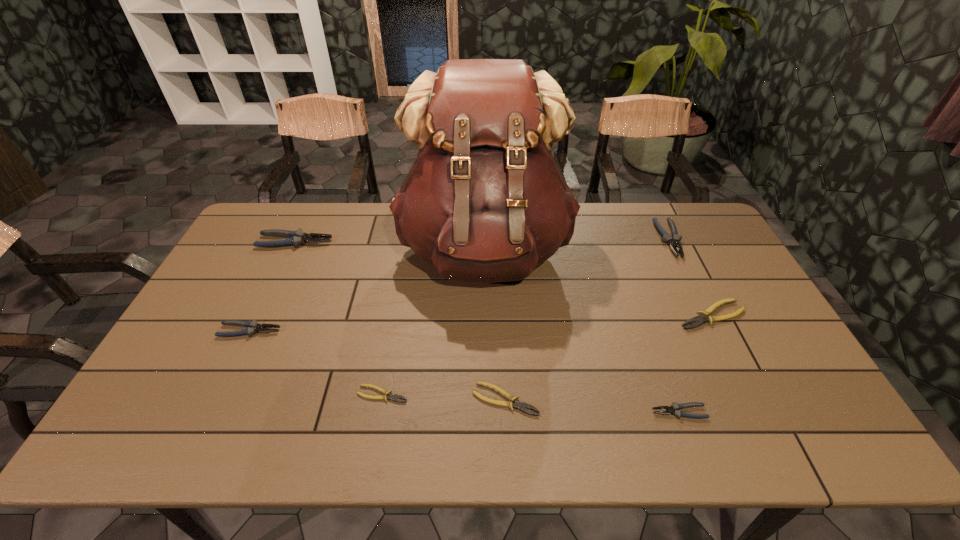
Identify which pliers is the fifth closest to the biggest yellow pliers. Please provide its 2D coordinates. Your answer should be formatted as a tuple, i.e. [(x, y)], where the tuple contains the x and y coordinates of a point satisfying the conditions above.

[(295, 238)]

Choose which pliers is the third nearest neighbor to the biggest gray pliers. Please provide its 2D coordinates. Your answer should be formatted as a tuple, i.e. [(x, y)], where the tuple contains the x and y coordinates of a point satisfying the conditions above.

[(517, 404)]

Find the location of `the closest gray pliers relative to the farthest yellow pliers`. the closest gray pliers relative to the farthest yellow pliers is located at coordinates (673, 241).

Where is `gray pliers that is the third closest to the second shortest object`? The width and height of the screenshot is (960, 540). gray pliers that is the third closest to the second shortest object is located at coordinates point(673,241).

Where is `yellow pliers that is the nearest to the farthest yellow pliers`? yellow pliers that is the nearest to the farthest yellow pliers is located at coordinates (517, 404).

Image resolution: width=960 pixels, height=540 pixels. I want to click on yellow pliers that is the second nearest to the sixth shortest pliers, so click(x=517, y=404).

Locate an element on the screen. The height and width of the screenshot is (540, 960). vacant space that satisfies the following two spatial constraints: 1. at the gripping part of the second tallest pliers; 2. at the gripping part of the biggest gray pliers is located at coordinates (671, 242).

The image size is (960, 540). Find the location of `vacant space that satisfies the following two spatial constraints: 1. at the gripping part of the fifth shortest pliers; 2. on the back side of the fifth pliers from right to left`. vacant space that satisfies the following two spatial constraints: 1. at the gripping part of the fifth shortest pliers; 2. on the back side of the fifth pliers from right to left is located at coordinates (220, 394).